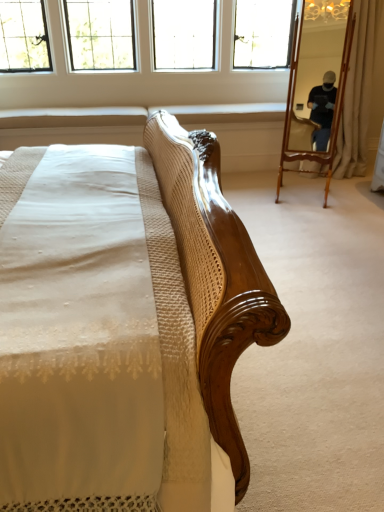
Question: Is wooden mirror at right looking in the opposite direction of beige fabric curtain at right?

Choices:
 (A) no
 (B) yes

Answer: (A)

Question: Does wooden mirror at right have a smaller size compared to beige fabric curtain at right?

Choices:
 (A) no
 (B) yes

Answer: (A)

Question: Is wooden mirror at right thinner than beige fabric curtain at right?

Choices:
 (A) yes
 (B) no

Answer: (B)

Question: Considering the relative sizes of wooden mirror at right and beige fabric curtain at right in the image provided, is wooden mirror at right taller than beige fabric curtain at right?

Choices:
 (A) no
 (B) yes

Answer: (A)

Question: Does wooden mirror at right have a larger size compared to beige fabric curtain at right?

Choices:
 (A) yes
 (B) no

Answer: (A)

Question: Is the surface of wooden mirror at right in direct contact with beige fabric curtain at right?

Choices:
 (A) yes
 (B) no

Answer: (B)

Question: From a real-world perspective, is wooden mirror at right below clear glass windows at upper center?

Choices:
 (A) yes
 (B) no

Answer: (A)

Question: Is wooden mirror at right in front of clear glass windows at upper center?

Choices:
 (A) no
 (B) yes

Answer: (B)

Question: Is wooden mirror at right wider than clear glass windows at upper center?

Choices:
 (A) yes
 (B) no

Answer: (B)

Question: Is wooden mirror at right facing away from clear glass windows at upper center?

Choices:
 (A) no
 (B) yes

Answer: (A)

Question: Does wooden mirror at right have a lesser height compared to clear glass windows at upper center?

Choices:
 (A) yes
 (B) no

Answer: (B)

Question: Is wooden mirror at right not inside clear glass windows at upper center?

Choices:
 (A) yes
 (B) no

Answer: (A)

Question: Considering the relative sizes of clear glass windows at upper center and beige fabric curtain at right in the image provided, is clear glass windows at upper center wider than beige fabric curtain at right?

Choices:
 (A) yes
 (B) no

Answer: (A)